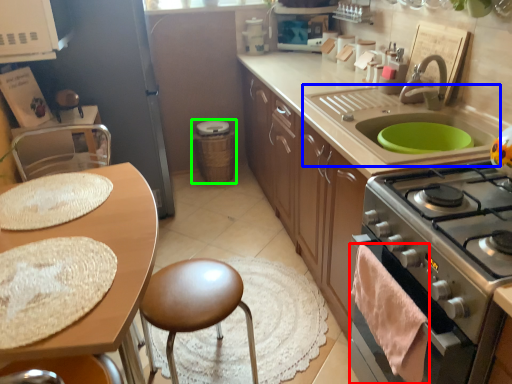
Question: Estimate the real-world distances between objects in this image. Which object is farther from material (highlighted by a red box), sink (highlighted by a blue box) or appliance (highlighted by a green box)?

Choices:
 (A) sink
 (B) appliance

Answer: (B)